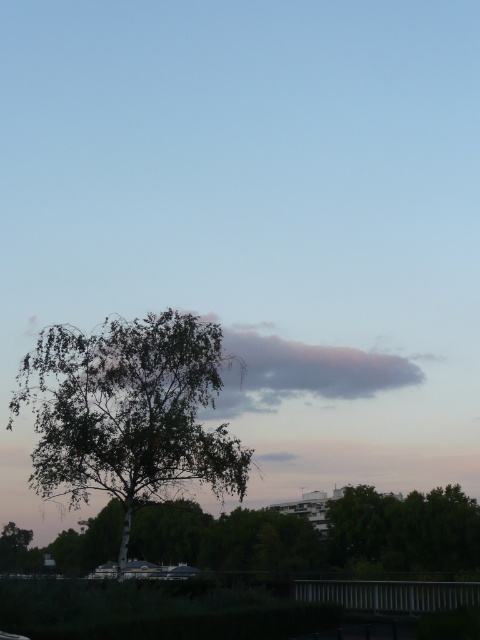
Question: Which of the following is the farthest from the observer?

Choices:
 (A) green leafy tree at lower center
 (B) green leafy tree at center

Answer: (A)

Question: Can you confirm if green leafy tree at center is wider than green leafy tree at lower center?

Choices:
 (A) no
 (B) yes

Answer: (A)

Question: Which point is closer to the camera?

Choices:
 (A) (108, 554)
 (B) (103, 465)

Answer: (B)

Question: Is green leafy tree at center to the right of green leafy tree at lower center from the viewer's perspective?

Choices:
 (A) no
 (B) yes

Answer: (B)

Question: Which of the following is the farthest from the observer?

Choices:
 (A) (372, 572)
 (B) (48, 353)

Answer: (A)

Question: Does green leafy tree at center appear over green leafy tree at lower center?

Choices:
 (A) yes
 (B) no

Answer: (A)